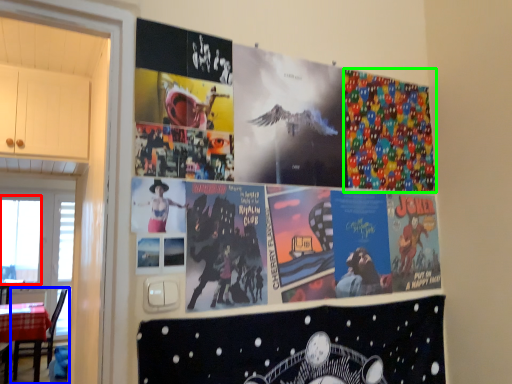
Question: Based on their relative distances, which object is farther from window screen (highlighted by a red box)? Choose from chair (highlighted by a blue box) and comic book (highlighted by a green box).

Choices:
 (A) chair
 (B) comic book

Answer: (B)